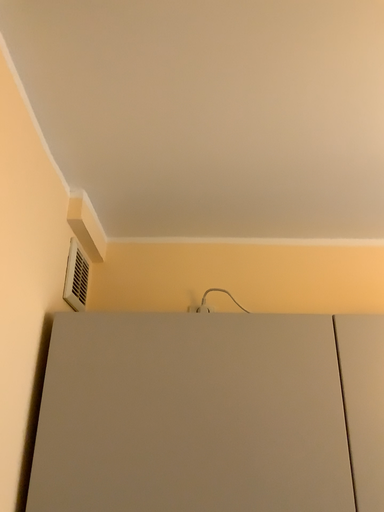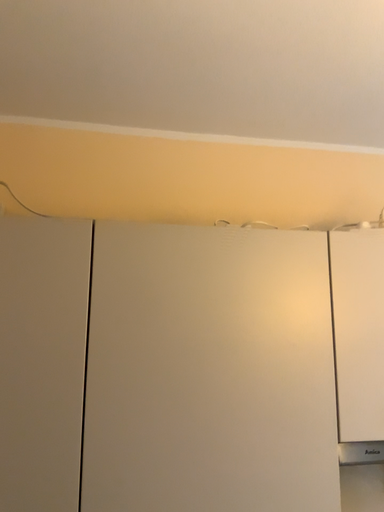
Question: How did the camera likely rotate when shooting the video?

Choices:
 (A) rotated upward
 (B) rotated downward

Answer: (B)